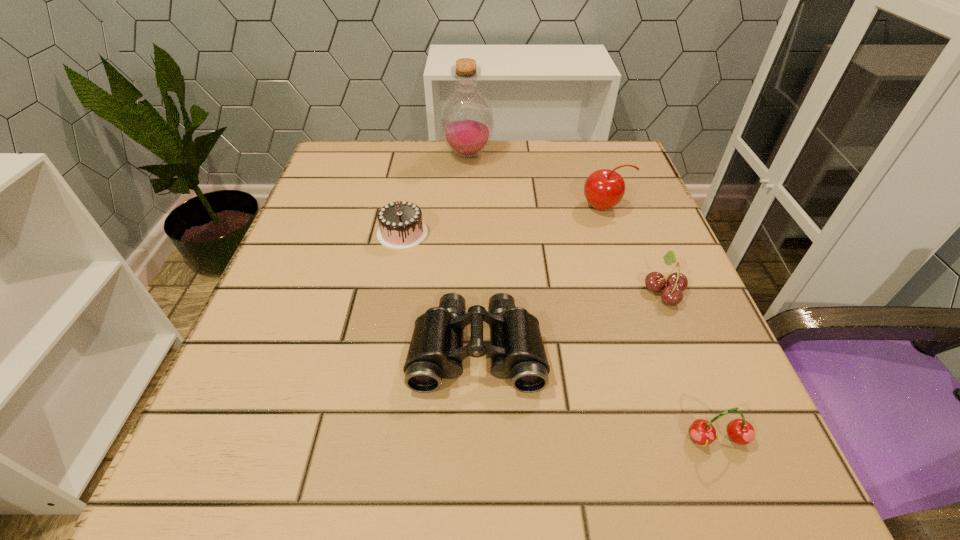
The height and width of the screenshot is (540, 960). In order to click on the tallest object in this screenshot , I will do `click(466, 122)`.

Where is `the farthest object`? the farthest object is located at coordinates (466, 122).

Identify the location of the tallest cherry. Image resolution: width=960 pixels, height=540 pixels. (603, 189).

You are a GUI agent. You are given a task and a screenshot of the screen. Output one action in this format:
    pyautogui.click(x=<x>, y=<y>)
    Task: Click on the fifth shortest object
    Image resolution: width=960 pixels, height=540 pixels.
    Given the screenshot: What is the action you would take?
    pyautogui.click(x=603, y=189)

Find the location of a particular element. This screenshot has width=960, height=540. chocolate cake is located at coordinates (401, 227).

Locate an element on the screen. binoculars is located at coordinates (516, 349).

Image resolution: width=960 pixels, height=540 pixels. I want to click on the nearest object, so click(740, 431).

At what (x,y) coordinates should I click in order to perform the action: click on the second nearest cherry. Please return your answer as a coordinate pair (x, y). The height and width of the screenshot is (540, 960). Looking at the image, I should click on (676, 283).

Identify the location of vacant area located on the front of the bottle. The image size is (960, 540). tap(466, 220).

The height and width of the screenshot is (540, 960). What are the coordinates of `vacant region located on the front of the tallest cherry` in the screenshot? It's located at (620, 254).